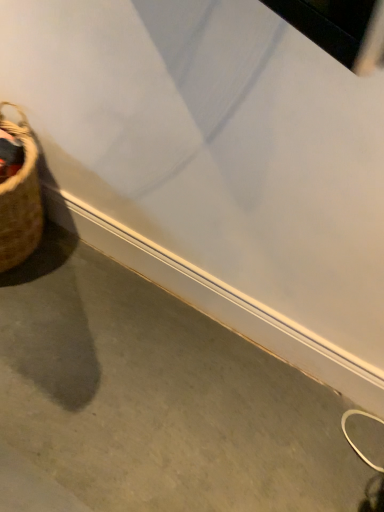
Identify the location of gray concrete at lower left. (158, 397).

This screenshot has width=384, height=512. Describe the element at coordinates (158, 397) in the screenshot. I see `gray concrete at lower left` at that location.

Find the location of a particular element. Image resolution: width=384 pixels, height=512 pixels. gray concrete at lower left is located at coordinates (158, 397).